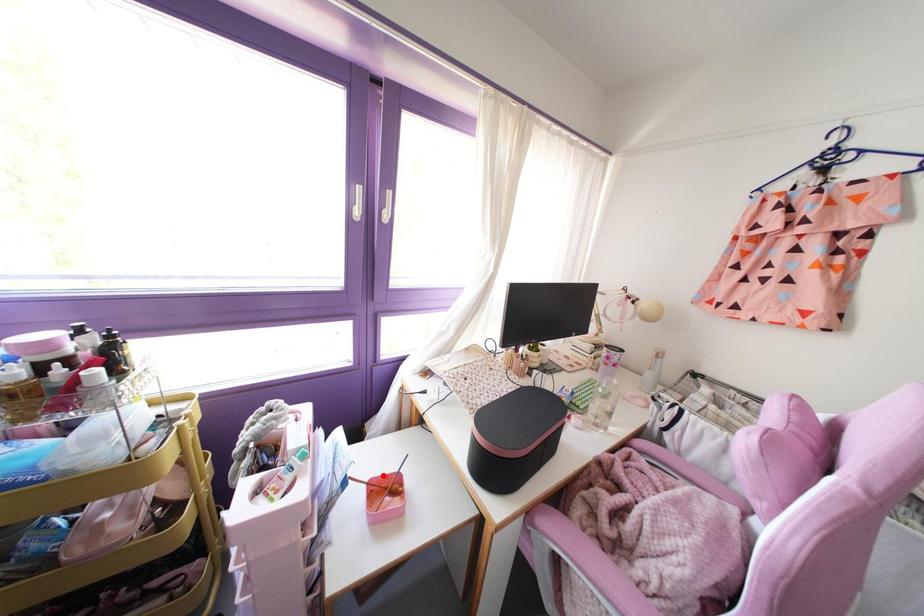
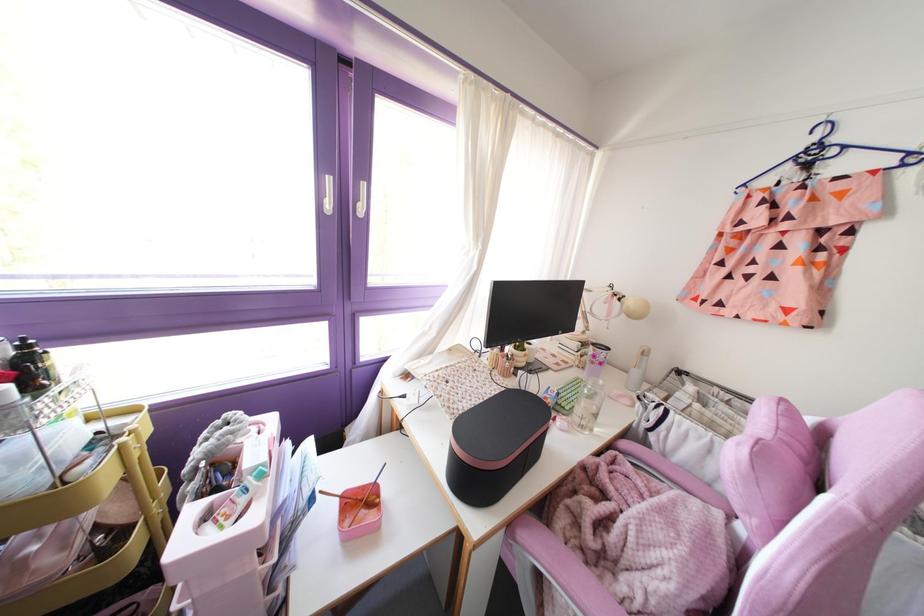
Find the pixel in the second image that matches the highlighted location in the first image.

(359, 487)